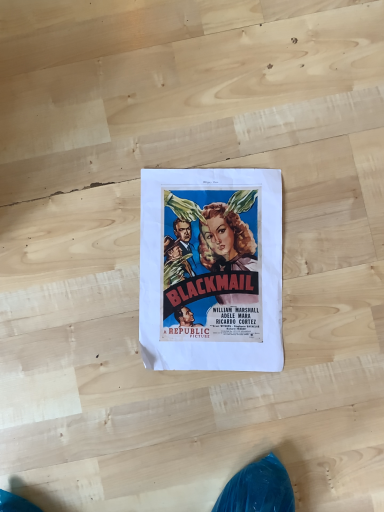
Where is `vacant area on top of vivid paper poster at center (from a real-world perspective)`? This screenshot has height=512, width=384. vacant area on top of vivid paper poster at center (from a real-world perspective) is located at coordinates (215, 268).